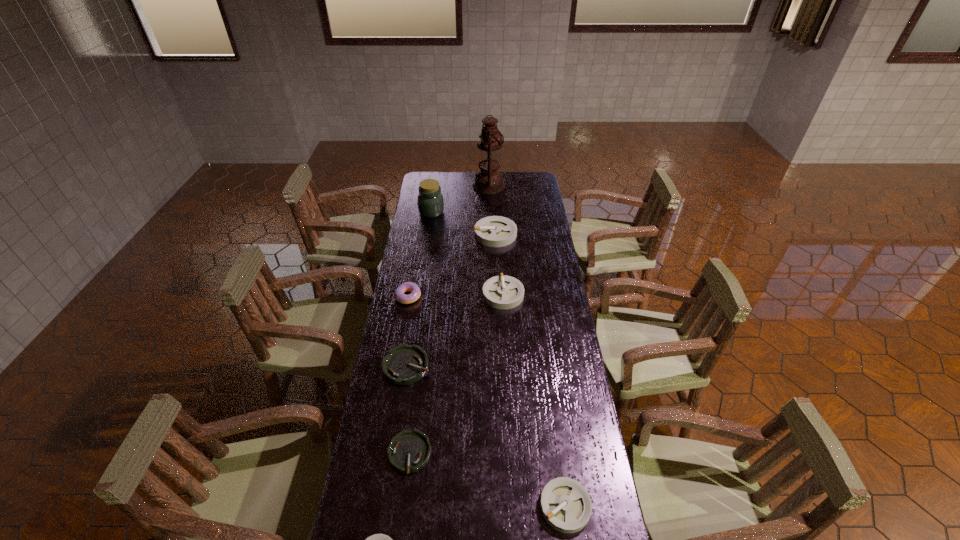
Locate which ashtray is the second closest to the tallest ashtray. Please provide its 2D coordinates. Your answer should be formatted as a tuple, i.e. [(x, y)], where the tuple contains the x and y coordinates of a point satisfying the conditions above.

[(403, 365)]

The height and width of the screenshot is (540, 960). Identify the location of the closest gray ashtray to the eighth shortest object. (493, 231).

Select which gray ashtray appears as the fourth closest to the pink doughnut. Please provide its 2D coordinates. Your answer should be formatted as a tuple, i.e. [(x, y)], where the tuple contains the x and y coordinates of a point satisfying the conditions above.

[(377, 539)]

Identify which green ashtray is the nearest to the doughnut. Please provide its 2D coordinates. Your answer should be formatted as a tuple, i.e. [(x, y)], where the tuple contains the x and y coordinates of a point satisfying the conditions above.

[(403, 365)]

Where is `green ashtray that can be found as the closest to the doughnut`? Image resolution: width=960 pixels, height=540 pixels. green ashtray that can be found as the closest to the doughnut is located at coordinates (403, 365).